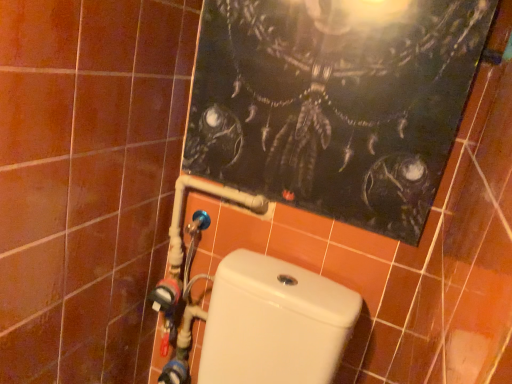
What are the coordinates of `brown matte tile at left` in the screenshot? It's located at (87, 181).

Based on the photo, what is the approximate width of blue plastic water pipe at lower left?

It is 4.83 inches.

In order to face white glossy toilet at lower center, should I rotate leftwards or rightwards?

You should look left and rotate roughly 3.036 degrees.

You are a GUI agent. You are given a task and a screenshot of the screen. Output one action in this format:
    pyautogui.click(x=<x>, y=<y>)
    Task: Click on the brown matte tile at left
    The image size is (512, 384).
    Given the screenshot: What is the action you would take?
    click(87, 181)

From the image's perspective, is blue plastic water pipe at lower left located beneath white glossy toilet at lower center?

Actually, blue plastic water pipe at lower left appears above white glossy toilet at lower center in the image.

Considering the points (160, 310) and (241, 281), which point is behind, point (160, 310) or point (241, 281)?

Positioned behind is point (160, 310).

Is blue plastic water pipe at lower left situated inside white glossy toilet at lower center or outside?

blue plastic water pipe at lower left is outside white glossy toilet at lower center.

Is the depth of blue plastic water pipe at lower left greater than that of white glossy toilet at lower center?

Yes, it is behind white glossy toilet at lower center.

Consider the image. Is brown matte tile at left with white glossy toilet at lower center?

No.

Is brown matte tile at left oriented towards white glossy toilet at lower center?

Yes.

Which is behind, brown matte tile at left or white glossy toilet at lower center?

brown matte tile at left.

Looking at the image, does brown matte tile at left seem bigger or smaller compared to white glossy toilet at lower center?

In the image, brown matte tile at left appears to be smaller than white glossy toilet at lower center.

Does blue plastic water pipe at lower left appear on the right side of dark matte poster at upper center?

In fact, blue plastic water pipe at lower left is to the left of dark matte poster at upper center.

Is blue plastic water pipe at lower left in front of or behind dark matte poster at upper center in the image?

In the image, blue plastic water pipe at lower left appears behind dark matte poster at upper center.

Is point (249, 205) less distant than point (302, 160)?

No, it is behind (302, 160).

Is blue plastic water pipe at lower left positioned with its back to dark matte poster at upper center?

No.

Considering the relative sizes of white glossy toilet at lower center and blue plastic water pipe at lower left in the image provided, is white glossy toilet at lower center taller than blue plastic water pipe at lower left?

No, white glossy toilet at lower center is not taller than blue plastic water pipe at lower left.

From the picture: Does white glossy toilet at lower center have a lesser width compared to blue plastic water pipe at lower left?

Incorrect, the width of white glossy toilet at lower center is not less than that of blue plastic water pipe at lower left.

At what (x,y) coordinates should I click in order to perform the action: click on toilet on the right of blue plastic water pipe at lower left. Please return your answer as a coordinate pair (x, y). Looking at the image, I should click on (274, 323).

From a real-world perspective, is white glossy toilet at lower center under blue plastic water pipe at lower left?

Yes, from a real-world perspective, white glossy toilet at lower center is under blue plastic water pipe at lower left.

From the image's perspective, is dark matte poster at upper center located above or below brown matte tile at left?

dark matte poster at upper center is situated higher than brown matte tile at left in the image.

Can you confirm if dark matte poster at upper center is smaller than brown matte tile at left?

Correct, dark matte poster at upper center occupies less space than brown matte tile at left.

Is dark matte poster at upper center in contact with brown matte tile at left?

dark matte poster at upper center and brown matte tile at left are clearly separated.

Is dark matte poster at upper center aimed at white glossy toilet at lower center?

No.

Which object is further away from the camera taking this photo, dark matte poster at upper center or white glossy toilet at lower center?

dark matte poster at upper center is further from the camera.

In terms of height, does dark matte poster at upper center look taller or shorter compared to white glossy toilet at lower center?

In the image, dark matte poster at upper center appears to be taller than white glossy toilet at lower center.

Considering the points (394, 34) and (270, 343), which point is behind, point (394, 34) or point (270, 343)?

Positioned behind is point (270, 343).

From a real-world perspective, is brown matte tile at left above or below blue plastic water pipe at lower left?

brown matte tile at left is above blue plastic water pipe at lower left.

From the image's perspective, is brown matte tile at left located beneath blue plastic water pipe at lower left?

Incorrect, from the image's perspective, brown matte tile at left is higher than blue plastic water pipe at lower left.

Is brown matte tile at left located outside blue plastic water pipe at lower left?

Yes, brown matte tile at left is outside of blue plastic water pipe at lower left.

Which of these two, brown matte tile at left or blue plastic water pipe at lower left, is thinner?

With smaller width is brown matte tile at left.

At what (x,y) coordinates should I click in order to perform the action: click on toilet in front of the blue plastic water pipe at lower left. Please return your answer as a coordinate pair (x, y). Looking at the image, I should click on (274, 323).

Where is `ceramic tile that is above the white glossy toilet at lower center (from the image's perspective)`? The height and width of the screenshot is (384, 512). ceramic tile that is above the white glossy toilet at lower center (from the image's perspective) is located at coordinates (87, 181).

Considering their positions, is white glossy toilet at lower center positioned further to blue plastic water pipe at lower left than dark matte poster at upper center?

Among the two, dark matte poster at upper center is located further to blue plastic water pipe at lower left.

From the picture: Which object lies nearer to the anchor point brown matte tile at left, dark matte poster at upper center or blue plastic water pipe at lower left?

Among the two, blue plastic water pipe at lower left is located nearer to brown matte tile at left.

In the scene shown: Based on their spatial positions, is dark matte poster at upper center or white glossy toilet at lower center closer to brown matte tile at left?

dark matte poster at upper center.

Which object lies nearer to the anchor point brown matte tile at left, white glossy toilet at lower center or dark matte poster at upper center?

dark matte poster at upper center lies closer to brown matte tile at left than the other object.

Consider the image. Based on their spatial positions, is dark matte poster at upper center or blue plastic water pipe at lower left closer to white glossy toilet at lower center?

Among the two, blue plastic water pipe at lower left is located nearer to white glossy toilet at lower center.

Looking at this image, estimate the real-world distances between objects in this image. Which object is further from dark matte poster at upper center, brown matte tile at left or white glossy toilet at lower center?

brown matte tile at left is positioned further to the anchor dark matte poster at upper center.

When comparing their distances from white glossy toilet at lower center, does brown matte tile at left or dark matte poster at upper center seem further?

brown matte tile at left is further to white glossy toilet at lower center.

Considering their positions, is blue plastic water pipe at lower left positioned closer to brown matte tile at left than dark matte poster at upper center?

Among the two, blue plastic water pipe at lower left is located nearer to brown matte tile at left.

I want to click on ceramic tile between white glossy toilet at lower center and blue plastic water pipe at lower left from front to back, so click(87, 181).

Locate an element on the screen. The image size is (512, 384). ceramic tile between dark matte poster at upper center and white glossy toilet at lower center from top to bottom is located at coordinates (87, 181).

Where is `water pipe that lies between dark matte poster at upper center and white glossy toilet at lower center from top to bottom`? water pipe that lies between dark matte poster at upper center and white glossy toilet at lower center from top to bottom is located at coordinates (188, 273).

Locate an element on the screen. ceramic tile between dark matte poster at upper center and blue plastic water pipe at lower left in the vertical direction is located at coordinates (87, 181).